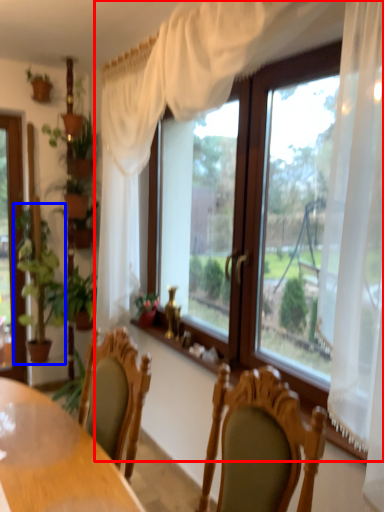
Question: Which of the following is the farthest to the observer, window (highlighted by a red box) or houseplant (highlighted by a blue box)?

Choices:
 (A) window
 (B) houseplant

Answer: (B)